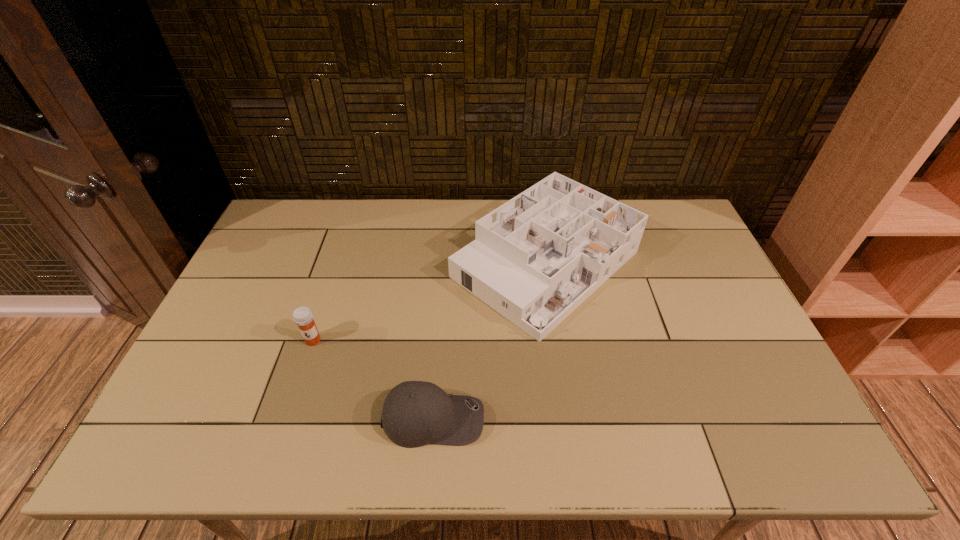
At what (x,y) coordinates should I click in order to perform the action: click on dollhouse. Please return your answer as a coordinate pair (x, y). The image size is (960, 540). Looking at the image, I should click on (536, 258).

The image size is (960, 540). In order to click on the leftmost object in this screenshot , I will do pyautogui.click(x=303, y=317).

Find the location of a particular element. This screenshot has width=960, height=540. the nearest object is located at coordinates (415, 413).

I want to click on vacant space located 0.230m on the left of the dollhouse, so click(x=378, y=264).

This screenshot has width=960, height=540. Find the location of `vacant area located on the label side of the leftmost object`. vacant area located on the label side of the leftmost object is located at coordinates (293, 401).

At what (x,y) coordinates should I click in order to perform the action: click on vacant region located on the front brim of the nearest object. Please return your answer as a coordinate pair (x, y). The width and height of the screenshot is (960, 540). Looking at the image, I should click on (577, 418).

Where is `object situated at the far edge`? object situated at the far edge is located at coordinates (536, 258).

Where is `object at the near edge`? This screenshot has height=540, width=960. object at the near edge is located at coordinates (415, 413).

The image size is (960, 540). I want to click on blank space at the far edge, so click(344, 237).

You are a GUI agent. You are given a task and a screenshot of the screen. Output one action in this format:
    pyautogui.click(x=<x>, y=<y>)
    Task: Click on the free location at the left edge of the desktop
    
    Given the screenshot: What is the action you would take?
    pyautogui.click(x=187, y=415)